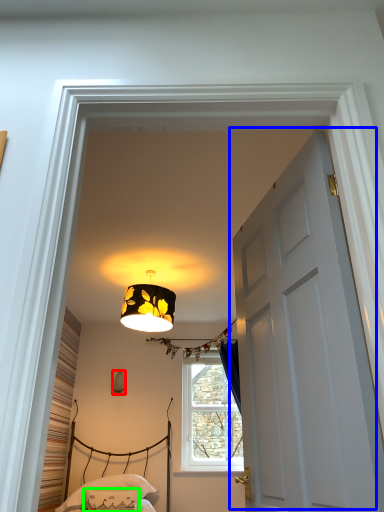
Question: Considering the real-world distances, which object is closest to lamp (highlighted by a red box)? door (highlighted by a blue box) or pillow (highlighted by a green box).

Choices:
 (A) door
 (B) pillow

Answer: (B)